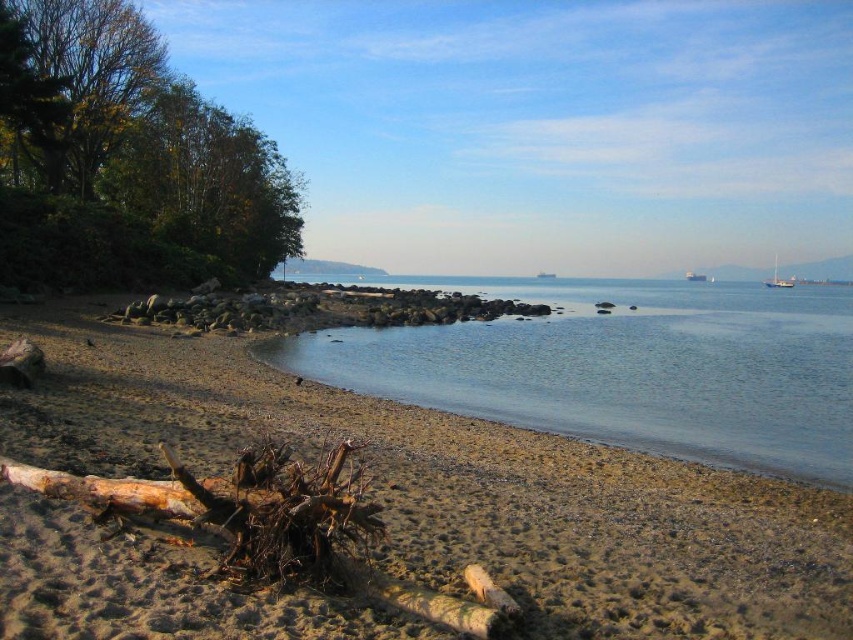
Looking at this image, between brown sandy beach at lower left and clear water at center, which one has less height?

brown sandy beach at lower left

Between point (634, 637) and point (437, 388), which one is positioned in front?

Positioned in front is point (634, 637).

Locate an element on the screen. This screenshot has width=853, height=640. brown sandy beach at lower left is located at coordinates (459, 488).

Can you confirm if brown sandy beach at lower left is positioned to the left of white glossy sailboat at upper right?

Yes, brown sandy beach at lower left is to the left of white glossy sailboat at upper right.

Which is behind, point (48, 324) or point (766, 280)?

The point (766, 280) is behind.

Measure the distance between point (x=635, y=605) and camera.

Point (x=635, y=605) and camera are 19.64 feet apart.

Where is `brown sandy beach at lower left`? The height and width of the screenshot is (640, 853). brown sandy beach at lower left is located at coordinates (459, 488).

Is point (386, 364) in front of point (766, 280)?

Yes, it is.

Which is below, clear water at center or white glossy sailboat at upper right?

Positioned lower is clear water at center.

Describe the element at coordinates (624, 368) in the screenshot. I see `clear water at center` at that location.

Locate an element on the screen. clear water at center is located at coordinates (624, 368).